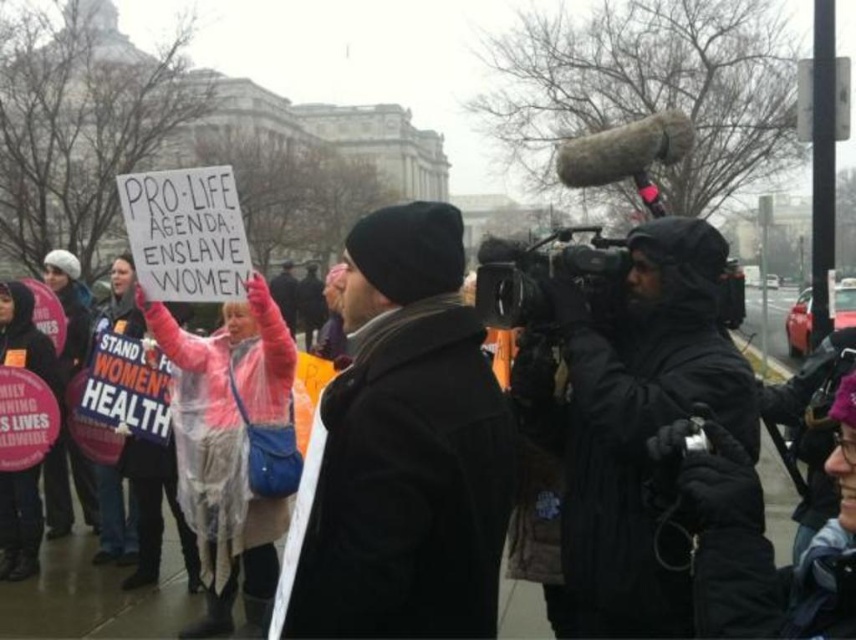
Which of these two, black woolen hat at center or pink waterproof jacket at center, stands taller?

pink waterproof jacket at center is taller.

Which is in front, point (389, 593) or point (175, 406)?

Point (389, 593) is more forward.

Which is in front, point (391, 337) or point (265, 532)?

Point (391, 337)

Find the location of a particular element. black woolen hat at center is located at coordinates (402, 451).